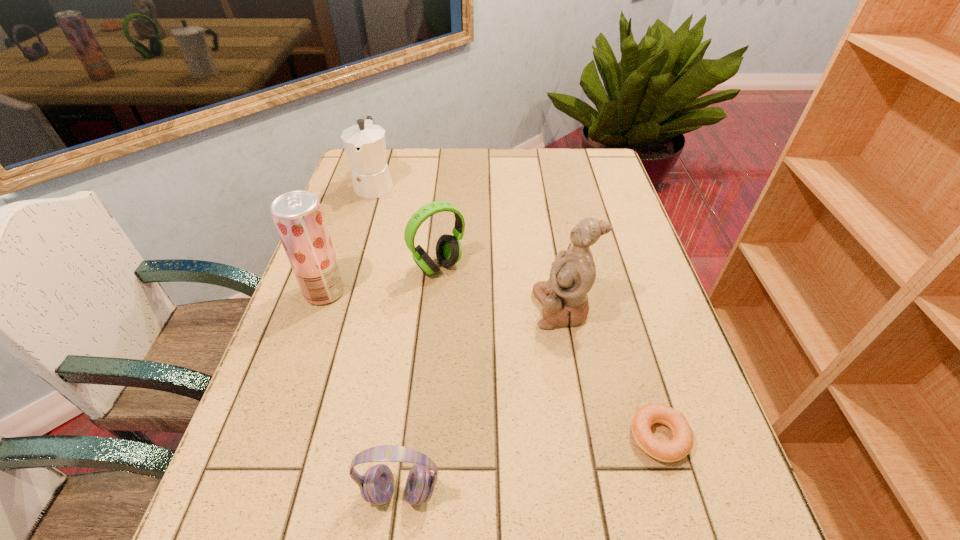
The width and height of the screenshot is (960, 540). I want to click on vacant space that's between the coffeepot and the fifth farthest object, so click(516, 310).

I want to click on free space between the shortest object and the fourth tallest object, so click(x=549, y=352).

Identify the location of unoccupied area between the bagel and the taller headset. (549, 352).

Find the location of a particular element. vacant space that's between the figurine and the shortest object is located at coordinates (611, 373).

Identify the location of object that is the nearest to the rightmost object. The image size is (960, 540). (564, 298).

Image resolution: width=960 pixels, height=540 pixels. I want to click on object that is the fifth closest to the fourth tallest object, so click(376, 486).

Where is `free space that satisfies the following two spatial constraints: 1. on the back side of the fourth tallest object; 2. on the left side of the fruit juice`? The image size is (960, 540). free space that satisfies the following two spatial constraints: 1. on the back side of the fourth tallest object; 2. on the left side of the fruit juice is located at coordinates (333, 266).

Locate an element on the screen. blank space that satisfies the following two spatial constraints: 1. on the front side of the fruit juice; 2. on the right side of the rightmost object is located at coordinates (276, 437).

The height and width of the screenshot is (540, 960). In order to click on free spot that satisfies the following two spatial constraints: 1. at the spout of the third shortest object; 2. on the left side of the coffeepot in this screenshot , I will do `click(349, 266)`.